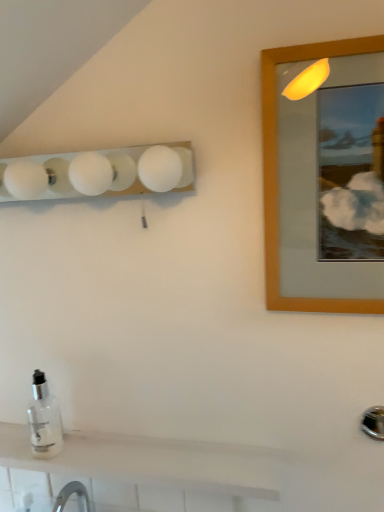
Question: Is white glossy tile at lower left far away from white frosted glass light fixture at upper left?

Choices:
 (A) yes
 (B) no

Answer: (B)

Question: Is white glossy tile at lower left behind white frosted glass light fixture at upper left?

Choices:
 (A) yes
 (B) no

Answer: (A)

Question: Considering the relative sizes of white glossy tile at lower left and white frosted glass light fixture at upper left in the image provided, is white glossy tile at lower left bigger than white frosted glass light fixture at upper left?

Choices:
 (A) yes
 (B) no

Answer: (B)

Question: From the image's perspective, is white glossy tile at lower left below white frosted glass light fixture at upper left?

Choices:
 (A) yes
 (B) no

Answer: (A)

Question: From a real-world perspective, is white glossy tile at lower left below white frosted glass light fixture at upper left?

Choices:
 (A) yes
 (B) no

Answer: (A)

Question: Looking at the image, does clear glass bottle at lower left seem bigger or smaller compared to white frosted glass light fixture at upper left?

Choices:
 (A) big
 (B) small

Answer: (B)

Question: Considering their positions, is clear glass bottle at lower left located in front of or behind white frosted glass light fixture at upper left?

Choices:
 (A) behind
 (B) front

Answer: (A)

Question: From a real-world perspective, is clear glass bottle at lower left physically located above or below white frosted glass light fixture at upper left?

Choices:
 (A) above
 (B) below

Answer: (B)

Question: Is clear glass bottle at lower left wider or thinner than white frosted glass light fixture at upper left?

Choices:
 (A) wide
 (B) thin

Answer: (B)

Question: Is point (165, 185) closer or farther from the camera than point (29, 482)?

Choices:
 (A) farther
 (B) closer

Answer: (B)

Question: Based on their positions, is white frosted glass light fixture at upper left located to the left or right of white glossy tile at lower left?

Choices:
 (A) left
 (B) right

Answer: (B)

Question: From a real-world perspective, relative to white glossy tile at lower left, is white frosted glass light fixture at upper left vertically above or below?

Choices:
 (A) below
 (B) above

Answer: (B)

Question: Considering the positions of white frosted glass light fixture at upper left and white glossy tile at lower left in the image, is white frosted glass light fixture at upper left wider or thinner than white glossy tile at lower left?

Choices:
 (A) thin
 (B) wide

Answer: (B)

Question: In the image, is wooden-framed mirror at upper right positioned in front of or behind clear glass bottle at lower left?

Choices:
 (A) front
 (B) behind

Answer: (A)

Question: In terms of height, does wooden-framed mirror at upper right look taller or shorter compared to clear glass bottle at lower left?

Choices:
 (A) short
 (B) tall

Answer: (B)